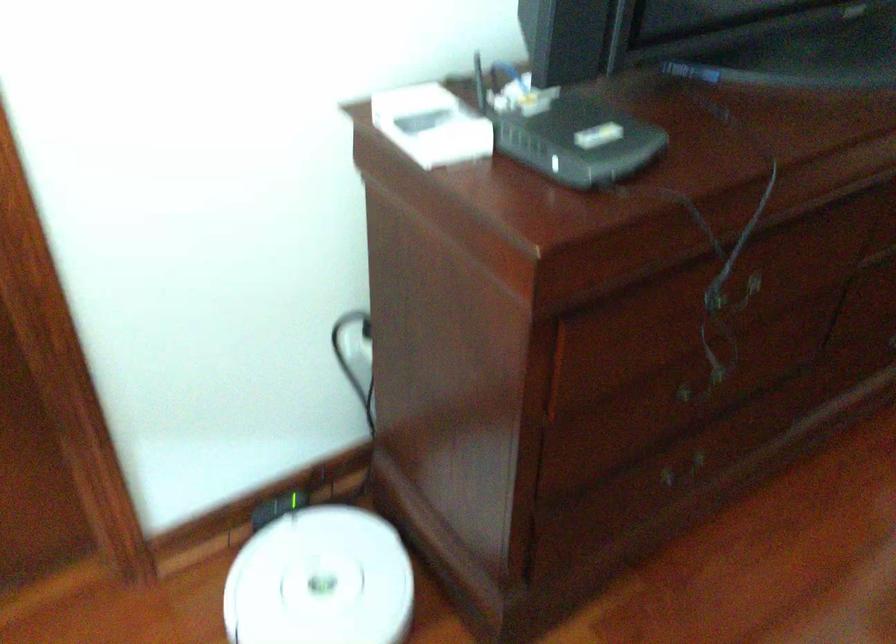
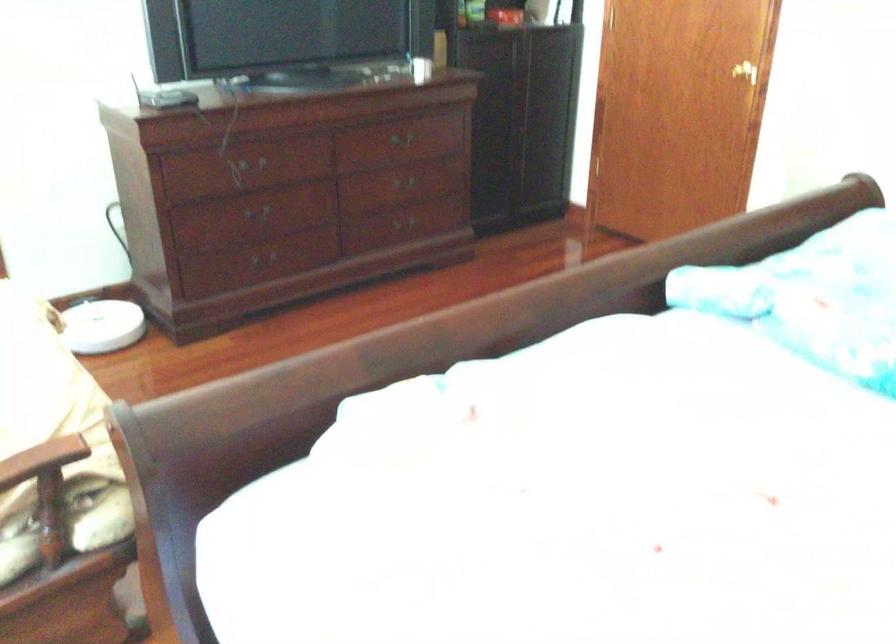
Find the pixel in the second image that matches (691,366) in the first image.

(255, 210)